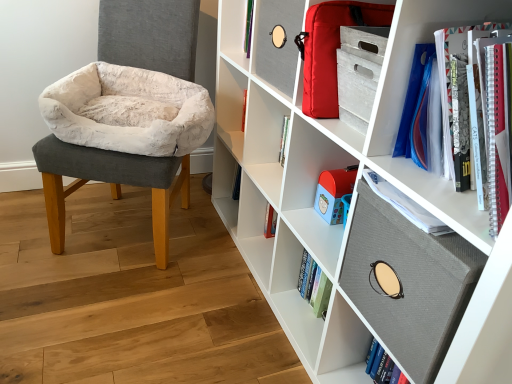
In order to click on vacant region to the right of white plush cushion at left in this screenshot , I will do `click(219, 260)`.